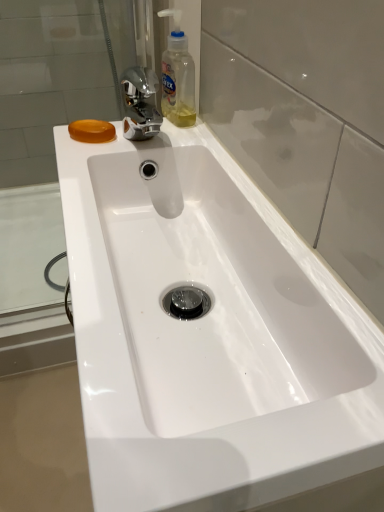
This screenshot has height=512, width=384. What are the coordinates of `vacant area in front of orange translucent soap at upper left` in the screenshot? It's located at (86, 170).